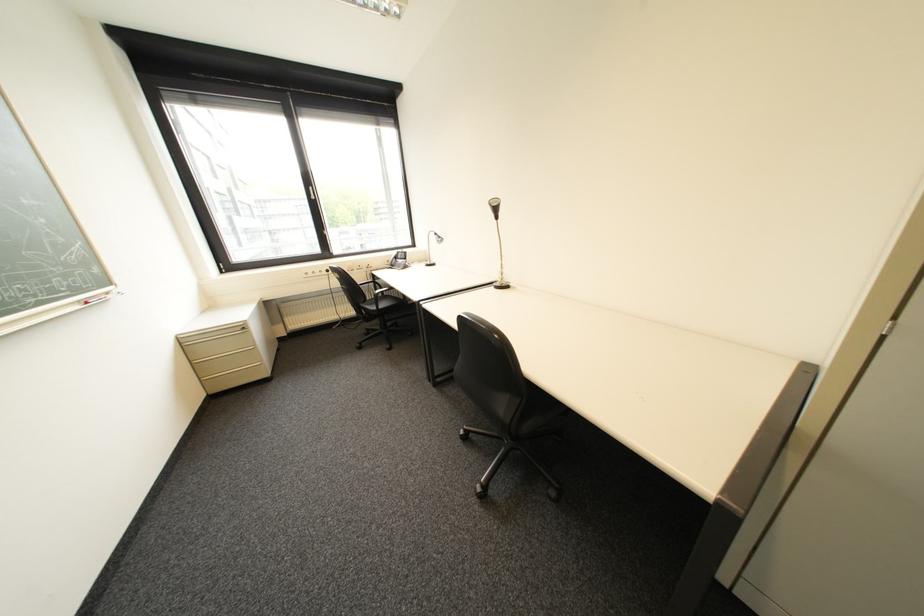
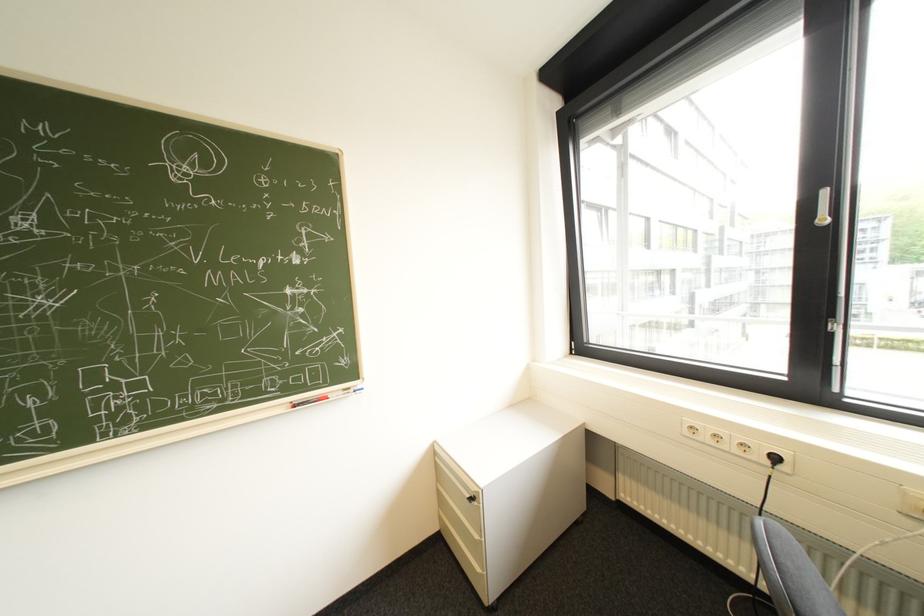
In the second image, find the point that corresponds to [321,188] in the first image.

(834, 193)